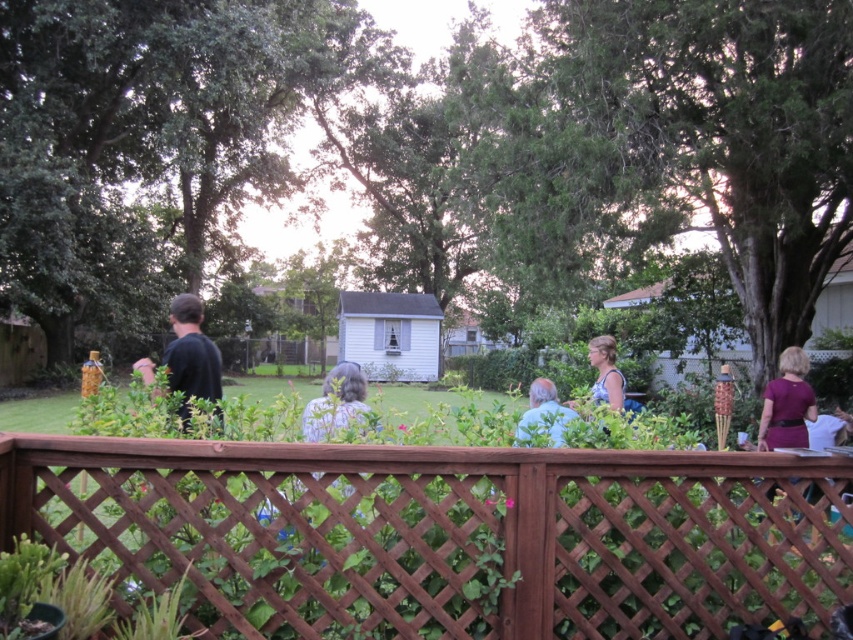
Does dark blue shirt at left have a greater height compared to blue denim dress at center?

Yes.

Who is more distant from viewer, (x=199, y=304) or (x=614, y=400)?

Positioned behind is point (x=614, y=400).

Does point (189, 314) lie behind point (589, 346)?

No, (189, 314) is in front of (589, 346).

Where is `dark blue shirt at left`? The height and width of the screenshot is (640, 853). dark blue shirt at left is located at coordinates (190, 355).

Based on the photo, between purple fabric dress at right and gray hair at center, which one is positioned lower?

Positioned lower is gray hair at center.

Does purple fabric dress at right have a greater height compared to gray hair at center?

Yes.

The image size is (853, 640). Find the location of `purple fabric dress at right`. purple fabric dress at right is located at coordinates (787, 403).

This screenshot has width=853, height=640. In order to click on purple fabric dress at right in this screenshot , I will do `click(787, 403)`.

I want to click on gray hair at center, so click(x=338, y=403).

Find the location of a particular element. The width and height of the screenshot is (853, 640). gray hair at center is located at coordinates (338, 403).